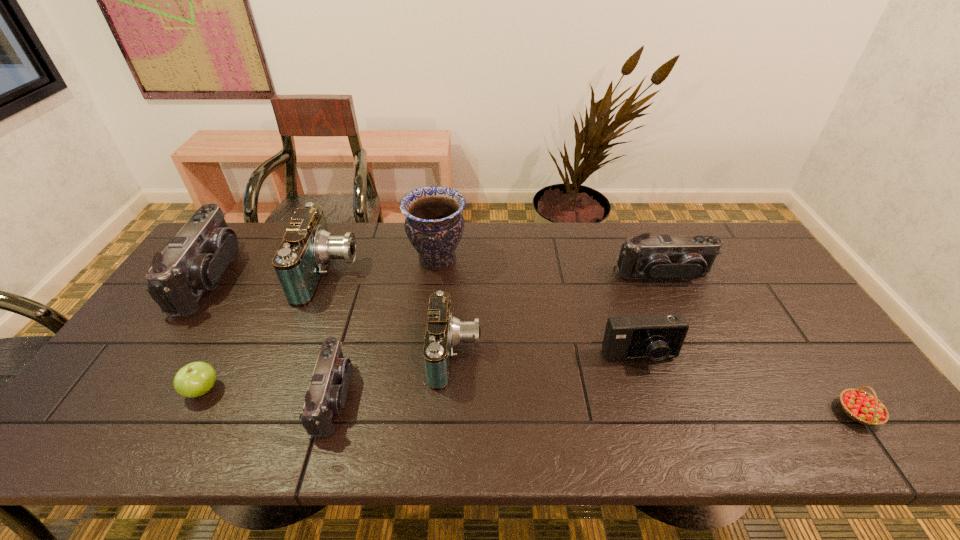
In order to click on the tallest object in this screenshot , I will do `click(434, 225)`.

Image resolution: width=960 pixels, height=540 pixels. I want to click on the left blue camcorder, so click(x=300, y=262).

Where is `the farther blue camcorder`? the farther blue camcorder is located at coordinates click(x=300, y=262).

Where is `the leftmost object`? This screenshot has height=540, width=960. the leftmost object is located at coordinates (194, 260).

Where is `the biggest black camcorder`? the biggest black camcorder is located at coordinates (194, 260).

This screenshot has width=960, height=540. I want to click on the second biggest black camcorder, so click(687, 257).

You are a GUI agent. You are given a task and a screenshot of the screen. Output one action in this format:
    pyautogui.click(x=<x>, y=<y>)
    Task: Click on the rightmost black camcorder
    The height and width of the screenshot is (540, 960).
    Given the screenshot: What is the action you would take?
    pyautogui.click(x=687, y=257)

Identify the location of the fourth camcorder from left to right. (444, 331).

Locate an element on the screen. This screenshot has width=960, height=540. the nearer blue camcorder is located at coordinates (444, 331).

This screenshot has height=540, width=960. I want to click on blue camera, so click(658, 336).